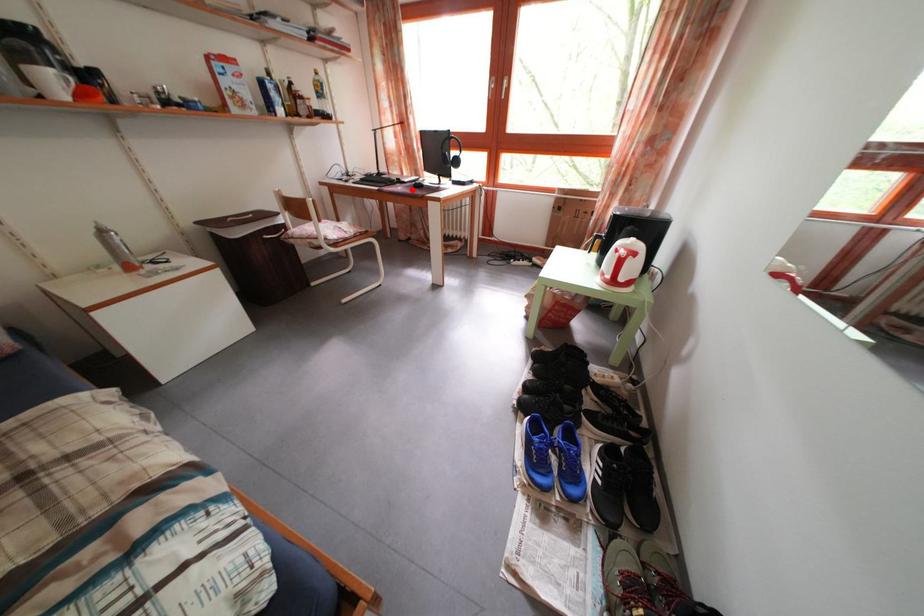
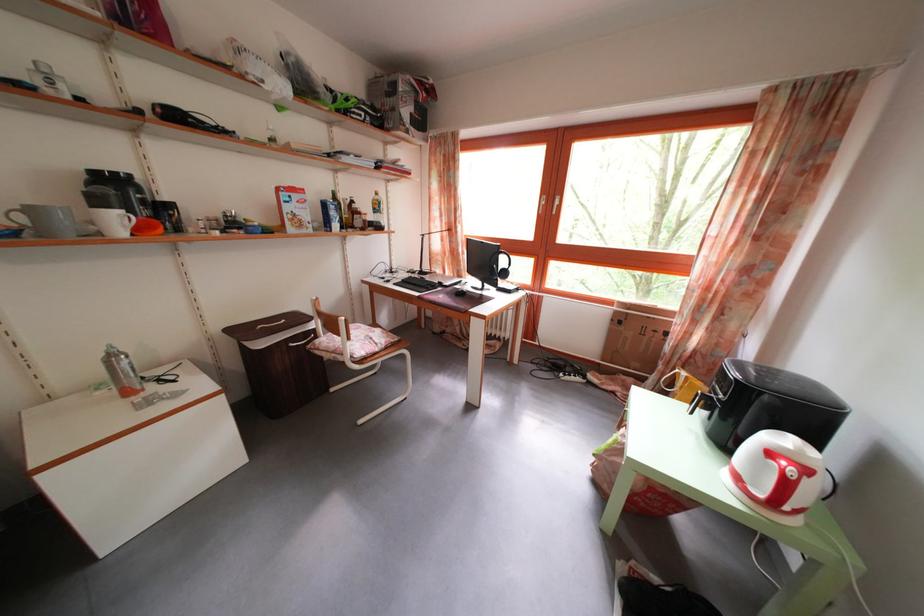
Locate, in the second image, the point that corresponds to the highlighted location in the first image.

(454, 294)